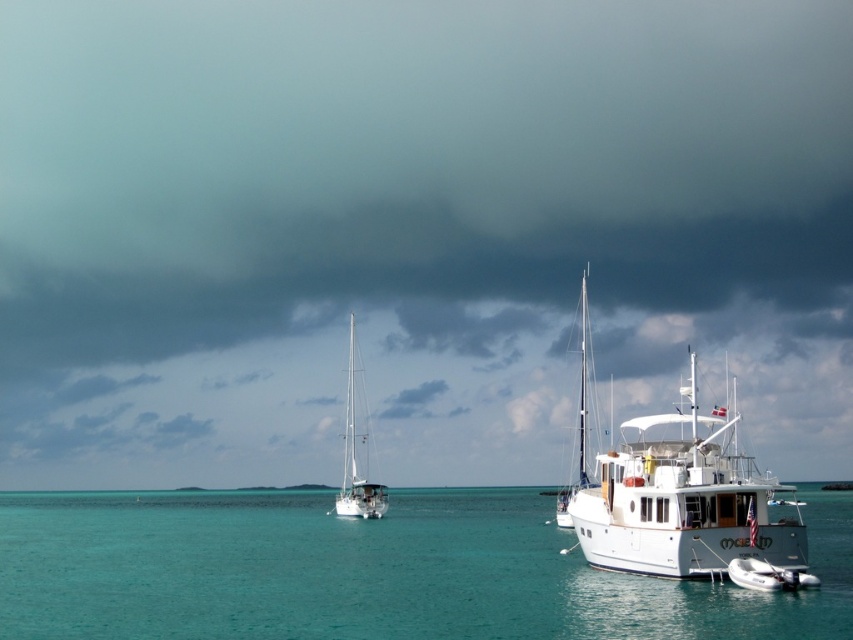
Question: Which point is farther to the camera?

Choices:
 (A) white glossy sailboat at right
 (B) white matte boat at lower right
 (C) turquoise water at center
 (D) white glossy sailboat at center

Answer: (D)

Question: Can you confirm if white matte boat at lower right is positioned below white glossy sailboat at right?

Choices:
 (A) no
 (B) yes

Answer: (B)

Question: Which of the following is the farthest from the observer?

Choices:
 (A) (694, 547)
 (B) (582, 477)

Answer: (B)

Question: Where is turquoise water at center located in relation to white matte boat at lower right in the image?

Choices:
 (A) right
 (B) left

Answer: (B)

Question: Which object appears closest to the camera in this image?

Choices:
 (A) white glossy sailboat at right
 (B) white glossy sailboat at center
 (C) white matte boat at lower right

Answer: (C)

Question: Is the position of turquoise water at center less distant than that of white glossy sailboat at right?

Choices:
 (A) yes
 (B) no

Answer: (A)